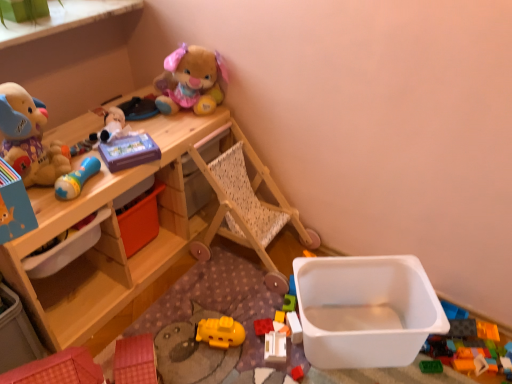
The width and height of the screenshot is (512, 384). What are the coordinates of `vacant area that lies between wooden baby carriage at center and wooden table at upper left` in the screenshot? It's located at (186, 303).